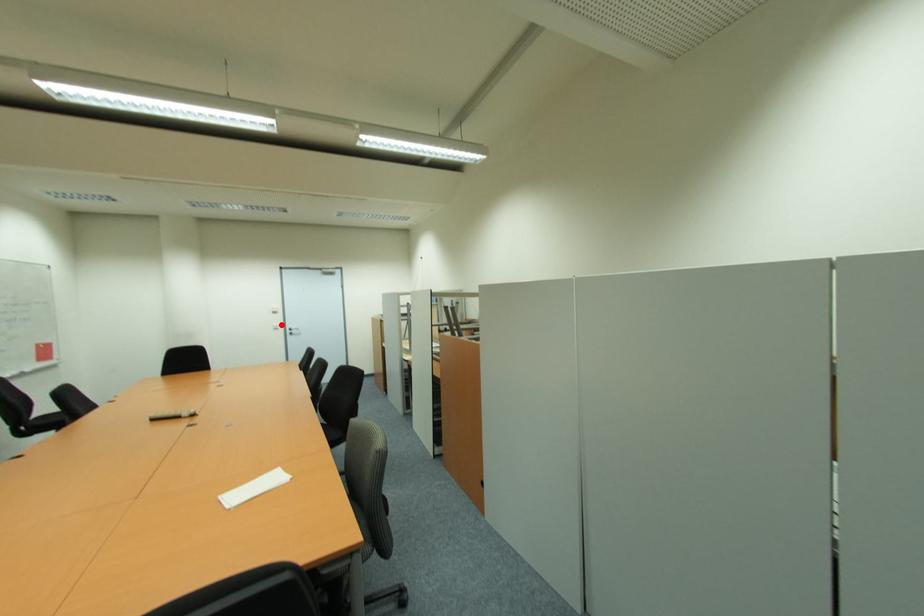
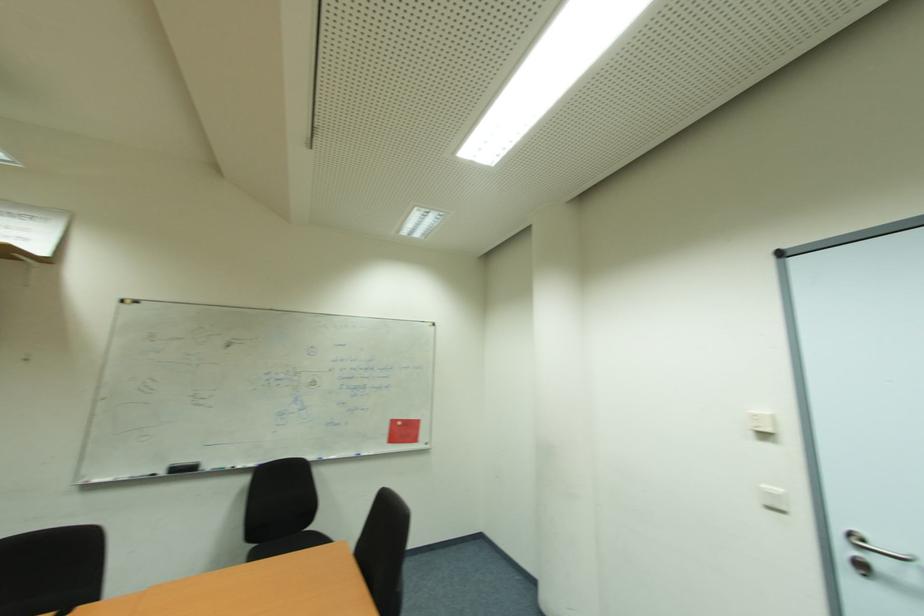
Find the pixel in the second image that matches the highlighted location in the first image.

(784, 492)